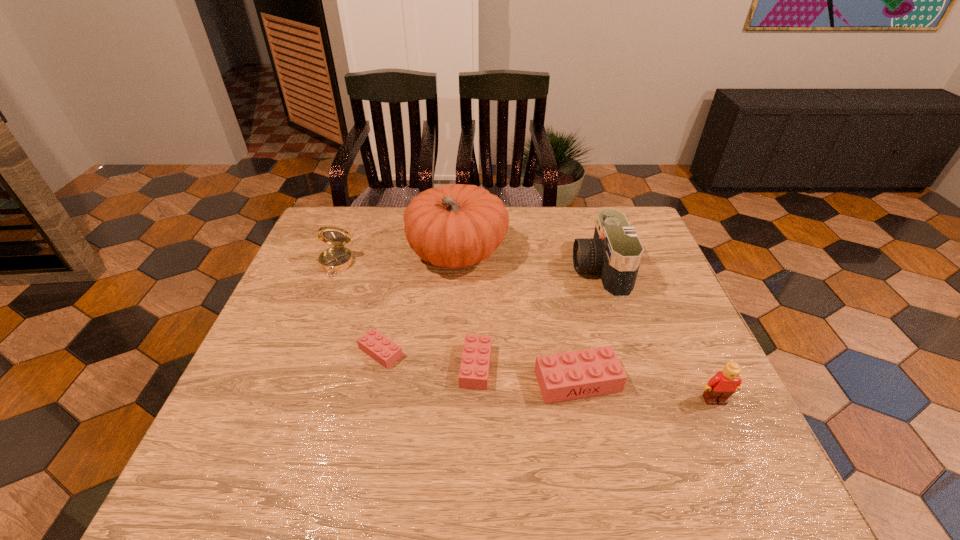
Where is `the leftmost Lego`? This screenshot has width=960, height=540. the leftmost Lego is located at coordinates (373, 343).

You are a GUI agent. You are given a task and a screenshot of the screen. Output one action in this format:
    pyautogui.click(x=<x>, y=<y>)
    Task: Click on the shortest Lego
    
    Given the screenshot: What is the action you would take?
    pyautogui.click(x=373, y=343)

What are the coordinates of `the sixth tallest object` in the screenshot? It's located at coord(474,370).

This screenshot has width=960, height=540. In order to click on the second Lego from left to right in this screenshot , I will do `click(474, 370)`.

In order to click on the second tallest Lego in this screenshot , I will do `click(572, 375)`.

Locate an element on the screen. the third Lego from left to right is located at coordinates (572, 375).

Identify the location of camera. This screenshot has height=540, width=960. (615, 252).

This screenshot has height=540, width=960. I want to click on pumpkin, so click(458, 225).

I want to click on compass, so click(338, 258).

Locate an element on the screen. Image resolution: width=960 pixels, height=540 pixels. the rightmost object is located at coordinates (719, 388).